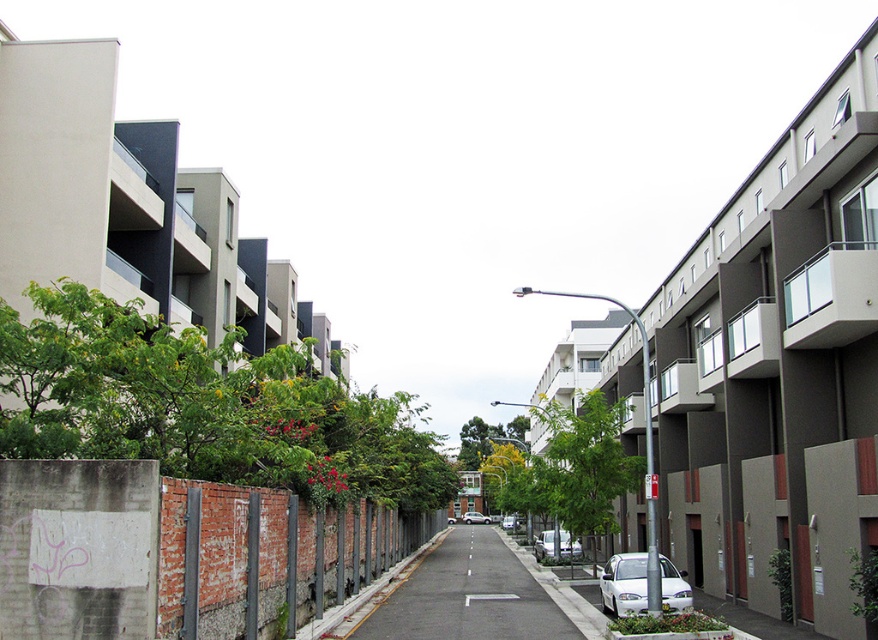
Describe the element at coordinates (203, 406) in the screenshot. I see `green leafy tree at left` at that location.

Does green leafy tree at left have a larger size compared to green leafy tree at center?

Correct, green leafy tree at left is larger in size than green leafy tree at center.

The height and width of the screenshot is (640, 878). I want to click on green leafy tree at left, so click(x=203, y=406).

Is green leafy tree at left wider than asphalt road at center?

Yes, green leafy tree at left is wider than asphalt road at center.

Does point (308, 470) come closer to viewer compared to point (358, 636)?

Yes, point (308, 470) is closer to viewer.

Describe the element at coordinates (203, 406) in the screenshot. Image resolution: width=878 pixels, height=640 pixels. I see `green leafy tree at left` at that location.

The width and height of the screenshot is (878, 640). Identify the location of green leafy tree at left. (203, 406).

Describe the element at coordinates (466, 595) in the screenshot. I see `asphalt road at center` at that location.

Based on the photo, who is lower down, asphalt road at center or green leafy tree at center?

asphalt road at center is lower down.

What do you see at coordinates (466, 595) in the screenshot? This screenshot has height=640, width=878. I see `asphalt road at center` at bounding box center [466, 595].

Image resolution: width=878 pixels, height=640 pixels. I want to click on asphalt road at center, so 466,595.